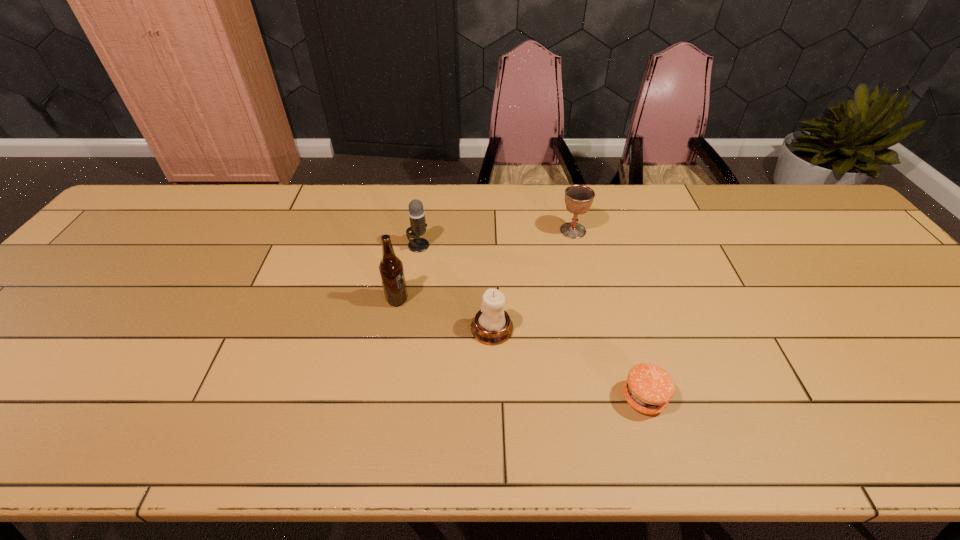
Image resolution: width=960 pixels, height=540 pixels. Find the location of `vacant position located 0.050m on the back of the chalice`. vacant position located 0.050m on the back of the chalice is located at coordinates coord(568,212).

In order to click on vacant area situated on the left of the fourth farthest object in this screenshot , I will do `click(384, 328)`.

Find the location of a particular element. This screenshot has width=960, height=540. free space located on the right of the nearest object is located at coordinates (746, 398).

Identify the location of object present at the far edge. This screenshot has width=960, height=540. (578, 198).

You are a GUI agent. You are given a task and a screenshot of the screen. Output one action in this format:
    pyautogui.click(x=<x>, y=<y>)
    Task: Click on the object at the near edge
    This screenshot has height=540, width=960.
    Given the screenshot: What is the action you would take?
    pyautogui.click(x=648, y=388)

Where is `free space at the far edge`? free space at the far edge is located at coordinates (509, 184).

Find the location of a particular element. Image resolution: width=960 pixels, height=540 pixels. free space at the near edge is located at coordinates (891, 418).

This screenshot has height=540, width=960. What are the coordinates of `vacant space at the left edge` in the screenshot? It's located at (84, 271).

In order to click on vacant area at the far left corner of the desktop in this screenshot , I will do `click(159, 201)`.

Identify the location of empty location between the nearest object and the chalice. [609, 314].